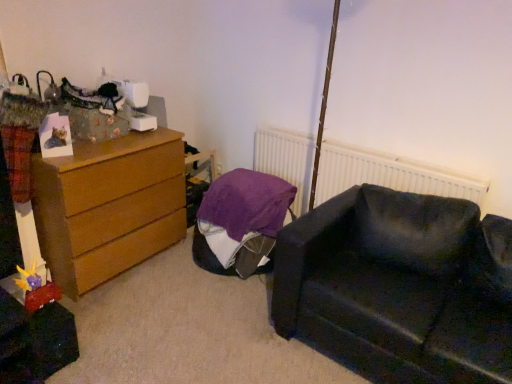
Question: From the image's perspective, is white textured radiator at upper center positioned above or below wooden chest of drawers at left?

Choices:
 (A) above
 (B) below

Answer: (A)

Question: Relative to wooden chest of drawers at left, is white textured radiator at upper center in front or behind?

Choices:
 (A) behind
 (B) front

Answer: (A)

Question: Estimate the real-world distances between objects in this image. Which object is closer to the purple fabric bean bag at center?

Choices:
 (A) white textured radiator at upper center
 (B) dark fabric couch at lower right
 (C) wooden chest of drawers at left
 (D) plush yellow and purple toy at lower left

Answer: (A)

Question: Which is nearer to the dark fabric couch at lower right?

Choices:
 (A) wooden chest of drawers at left
 (B) white textured radiator at upper center
 (C) plush yellow and purple toy at lower left
 (D) purple fabric bean bag at center

Answer: (B)